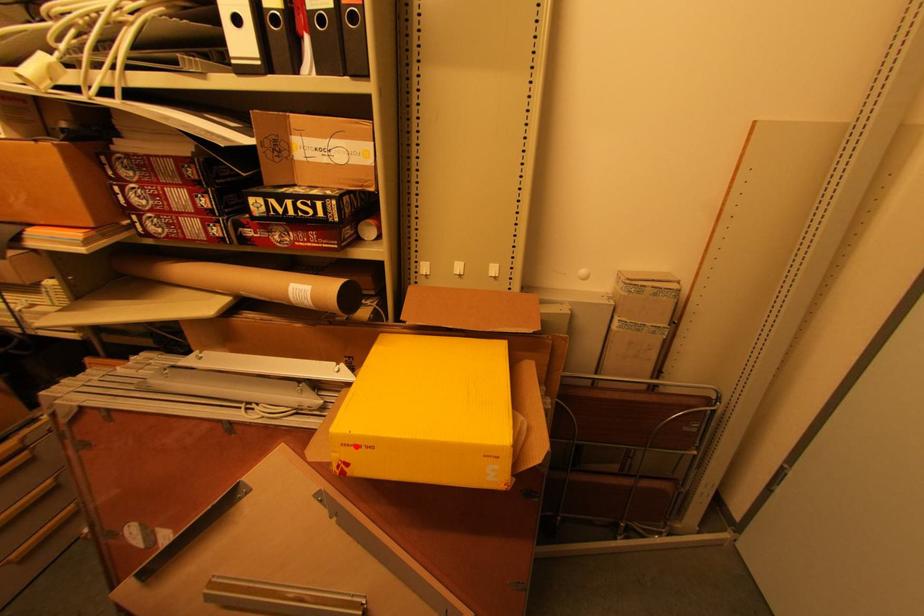
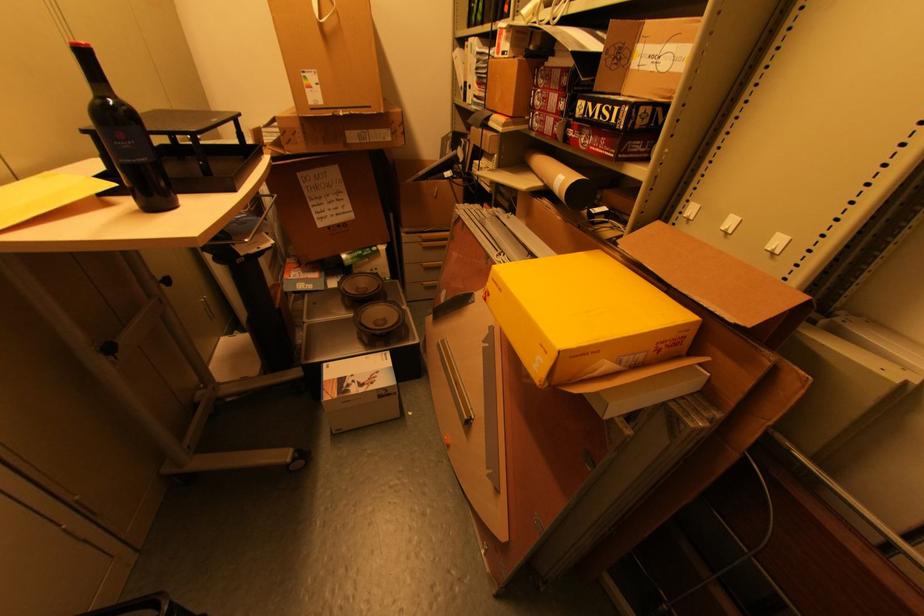
Where in the second image is the point corresponding to the highlighted location from the first image?

(499, 284)